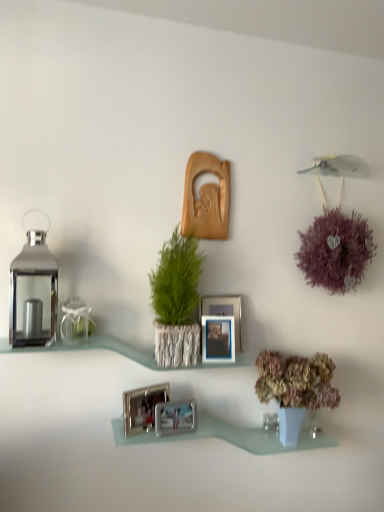
Question: Would you say silver metallic photo frame at center, arranged as the 1th picture frame when ordered from the bottom, is to the left or to the right of metallic silver picture frame at center, which is the 3th picture frame in top-to-bottom order, in the picture?

Choices:
 (A) left
 (B) right

Answer: (A)

Question: Is silver metallic photo frame at center, arranged as the 1th picture frame when ordered from the bottom, wider or thinner than metallic silver picture frame at center, which is the 3th picture frame in top-to-bottom order?

Choices:
 (A) wide
 (B) thin

Answer: (B)

Question: Estimate the real-world distances between objects in this image. Which object is closer to the green textured plant at center?

Choices:
 (A) silver metallic picture frame at center, the 2th picture frame positioned from the top
 (B) metallic silver picture frame at center, which is counted as the third picture frame, starting from the bottom
 (C) wooden carving at center, which appears as the first picture frame when viewed from the top
 (D) clear glass shelf at center, the second shelf ordered from the bottom
 (E) silver metallic photo frame at lower center, the fourth picture frame viewed from the top

Answer: (B)

Question: Which object is positioned closest to the clear glass shelf at center, which is the first shelf in top-to-bottom order?

Choices:
 (A) green textured plant at center
 (B) metallic silver picture frame at center, which is counted as the third picture frame, starting from the bottom
 (C) purple fluffy ball at upper right
 (D) wooden carving at center, which is the fifth picture frame from bottom to top
 (E) silver metallic picture frame at center, which is the fourth picture frame from bottom to top

Answer: (B)